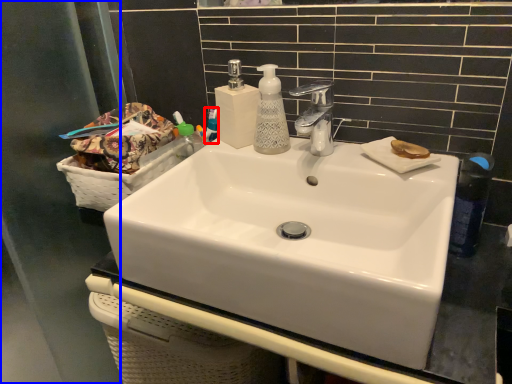
Question: Which object appears farthest to the camera in this image, mouthwash (highlighted by a red box) or screen door (highlighted by a blue box)?

Choices:
 (A) mouthwash
 (B) screen door

Answer: (A)